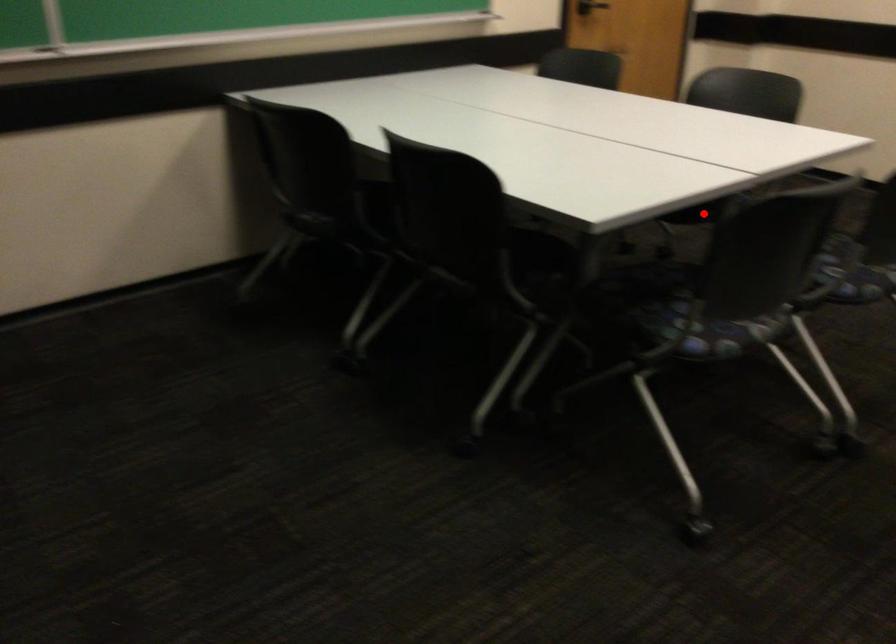
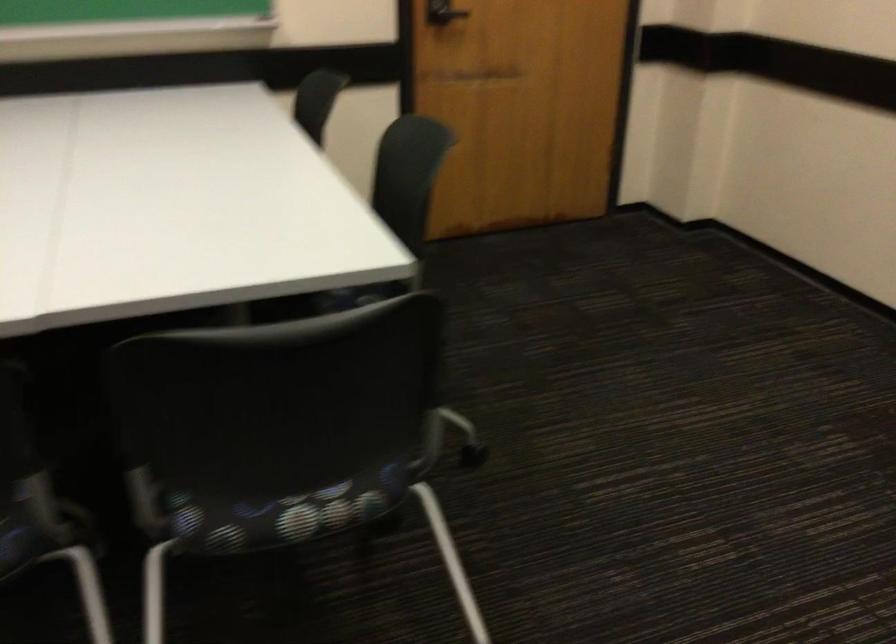
Question: I am providing you with two images of the same scene from different viewpoints. A red point is marked on the first image. Is the red point's position out of view in image 2?

Choices:
 (A) Yes
 (B) No

Answer: (A)